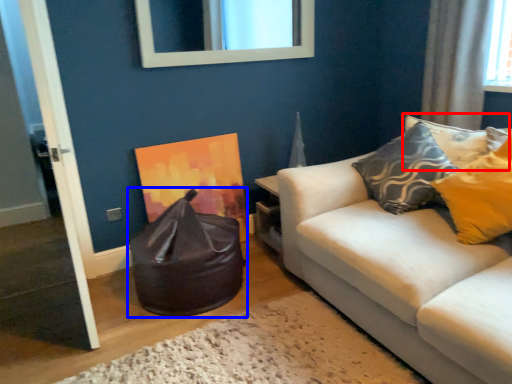
Question: Which object appears farthest to the camera in this image, pillow (highlighted by a red box) or bean bag chair (highlighted by a blue box)?

Choices:
 (A) pillow
 (B) bean bag chair

Answer: (A)